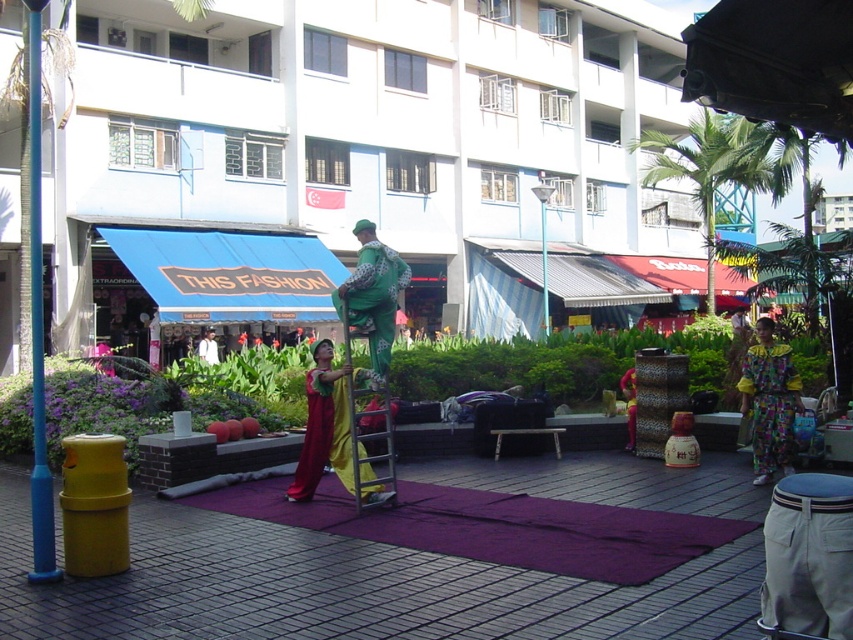
You are planning to set up a temporary booth for an event in the plaza. The booth requires a large flat surface. Which object between the purple fabric mat at center and the blue plastic pole at left would be more suitable for this purpose?

The blue plastic pole at left is more suitable for setting up a temporary booth because it is larger in size compared to the purple fabric mat at center.